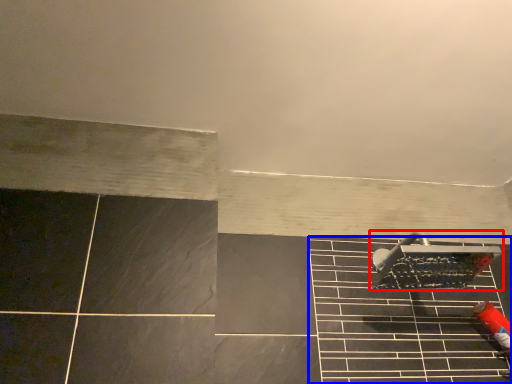
Question: Which object is further to the camera taking this photo, shower (highlighted by a red box) or ceramic tile (highlighted by a blue box)?

Choices:
 (A) shower
 (B) ceramic tile

Answer: (A)